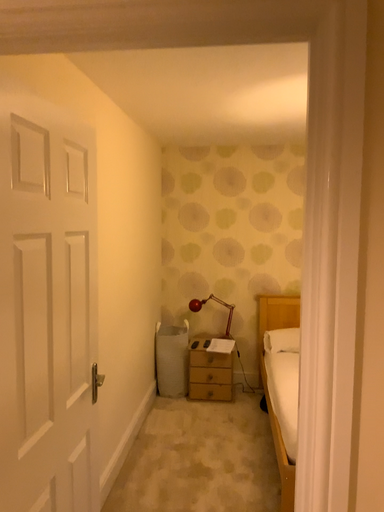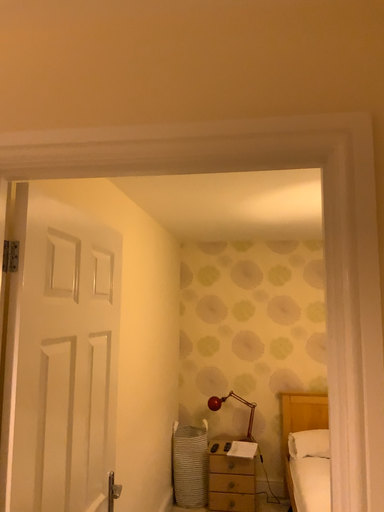
Question: Which way did the camera rotate in the video?

Choices:
 (A) rotated upward
 (B) rotated downward

Answer: (A)